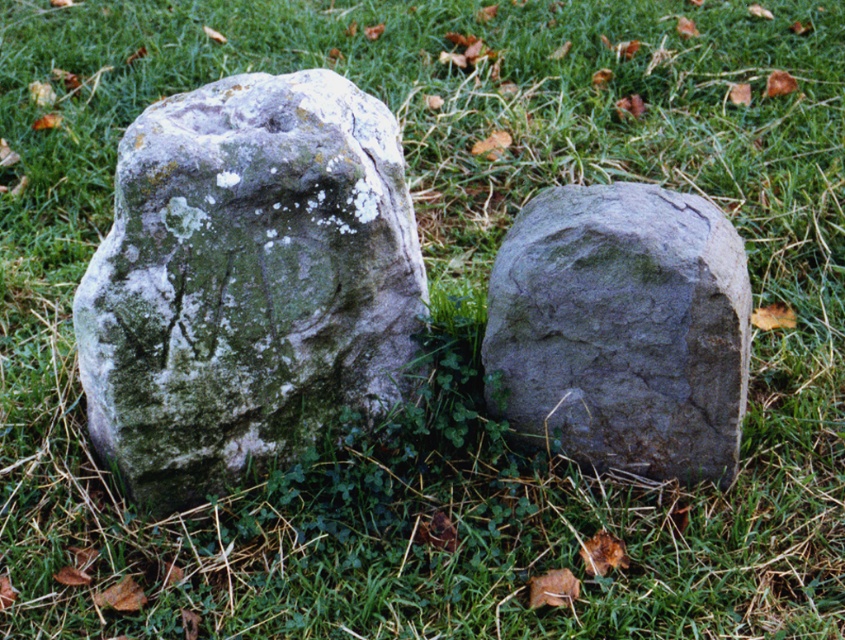
Is speckled gray stone at center below gray rough stone at center?

No.

Does speckled gray stone at center have a smaller size compared to gray rough stone at center?

No.

This screenshot has width=845, height=640. What do you see at coordinates (246, 280) in the screenshot?
I see `speckled gray stone at center` at bounding box center [246, 280].

The width and height of the screenshot is (845, 640). I want to click on speckled gray stone at center, so click(246, 280).